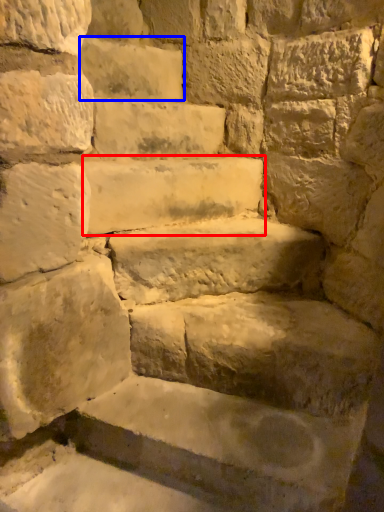
Question: Among these objects, which one is farthest to the camera, stone (highlighted by a red box) or brick (highlighted by a blue box)?

Choices:
 (A) stone
 (B) brick

Answer: (B)